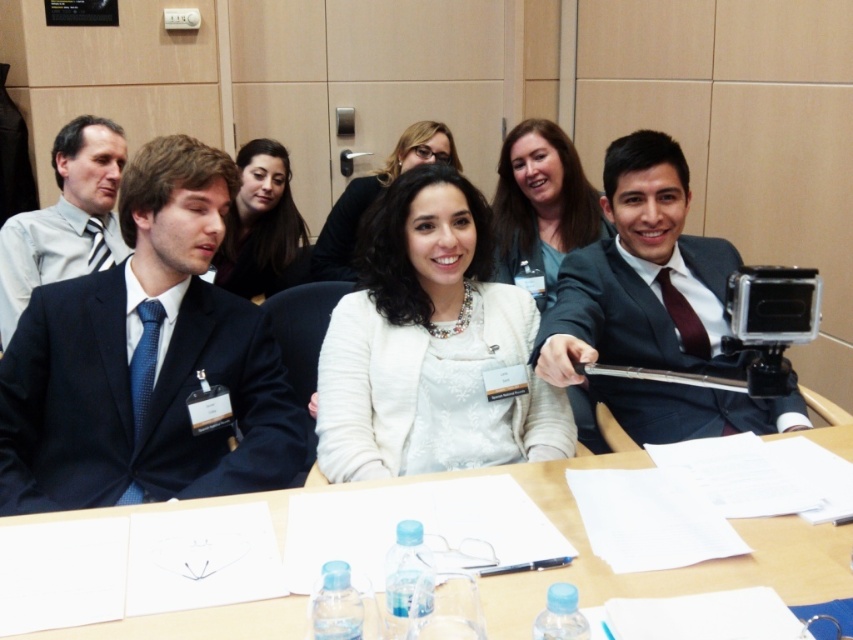
Question: Considering the relative positions of white matte sweater at center and matte black suit at right in the image provided, where is white matte sweater at center located with respect to matte black suit at right?

Choices:
 (A) left
 (B) right

Answer: (A)

Question: Which of the following is the farthest from the observer?

Choices:
 (A) (350, 189)
 (B) (624, 134)
 (C) (532, 250)
 (D) (123, 170)

Answer: (B)

Question: Is matte black suit at left bigger than matte black jacket at center?

Choices:
 (A) no
 (B) yes

Answer: (B)

Question: Does matte black jacket at center have a greater width compared to white fabric jacket at center?

Choices:
 (A) no
 (B) yes

Answer: (A)

Question: Which object appears farthest from the camera in this image?

Choices:
 (A) dark blue suit at left
 (B) white matte sweater at center
 (C) matte black jacket at center

Answer: (C)

Question: Which point is closer to the camera taking this photo?

Choices:
 (A) (347, 276)
 (B) (712, 307)

Answer: (B)